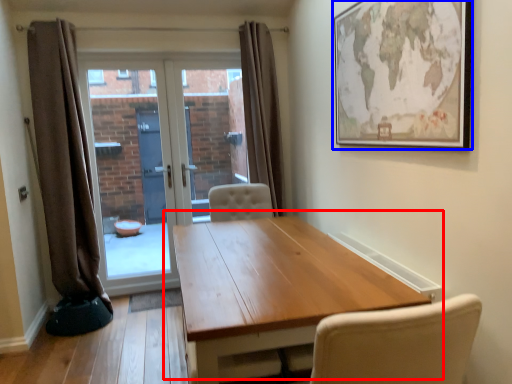
Question: Which point is closer to the camera, table (highlighted by a red box) or picture frame (highlighted by a blue box)?

Choices:
 (A) table
 (B) picture frame

Answer: (A)